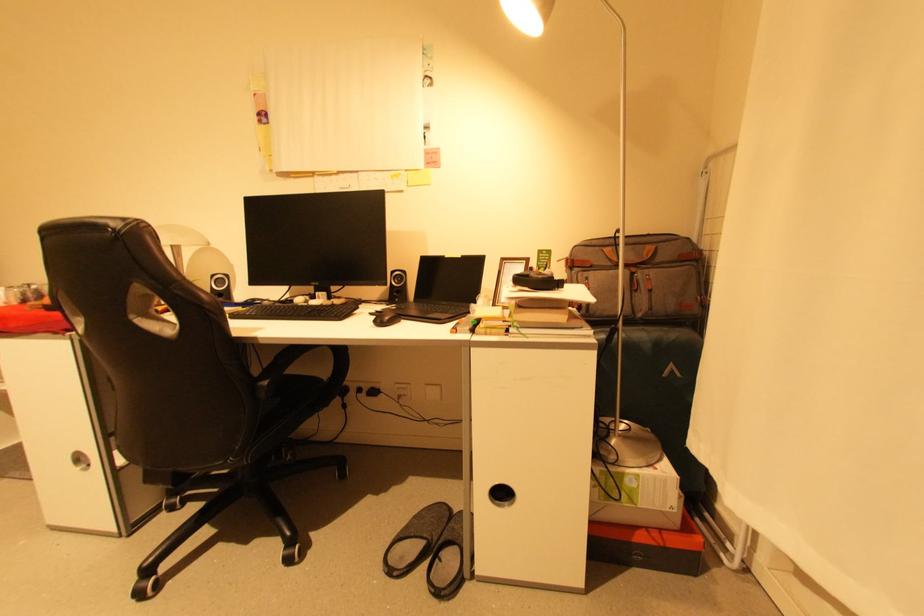
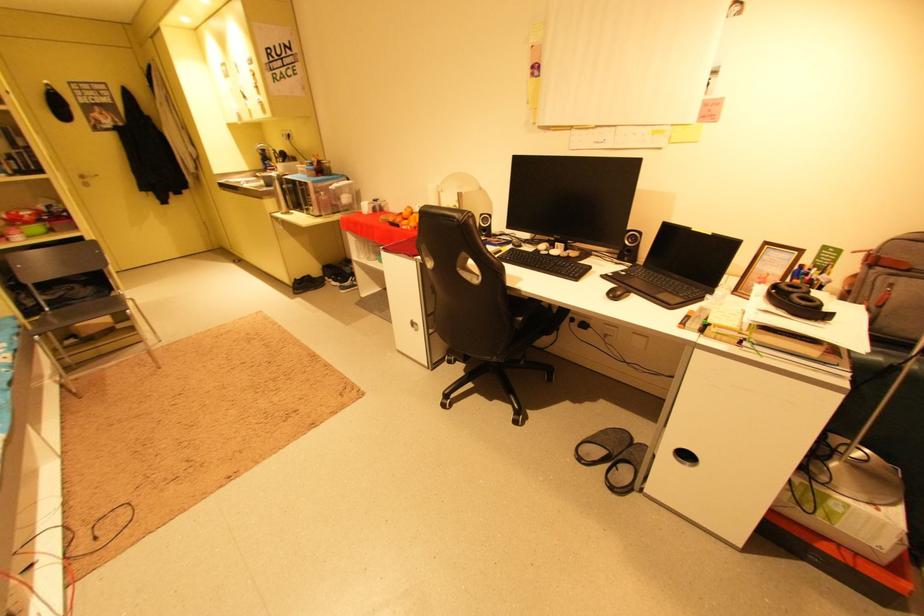
Locate, in the second image, the point that corresponds to [404,282] in the first image.

(638, 241)